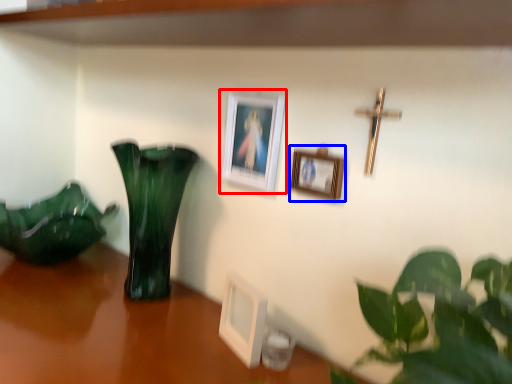
Question: Among these objects, which one is farthest to the camera, picture frame (highlighted by a red box) or picture frame (highlighted by a blue box)?

Choices:
 (A) picture frame
 (B) picture frame

Answer: (A)